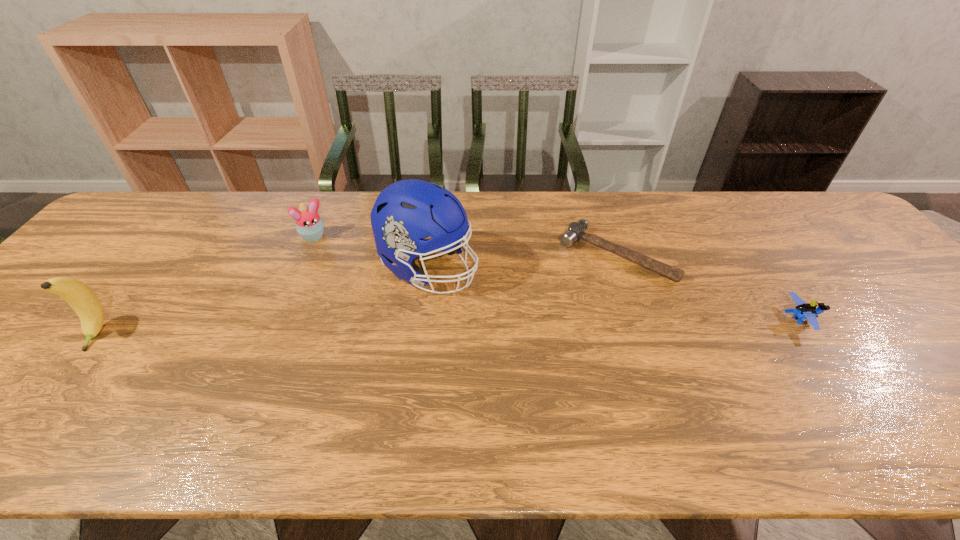
I want to click on vacant region between the cupcake and the hammer, so click(466, 246).

The height and width of the screenshot is (540, 960). I want to click on vacant point located between the Lego and the football helmet, so click(x=613, y=293).

Where is `unoccupied area between the third shortest object and the rightmost object`? This screenshot has height=540, width=960. unoccupied area between the third shortest object and the rightmost object is located at coordinates (557, 278).

Locate an element on the screen. The width and height of the screenshot is (960, 540). unoccupied position between the leftmost object and the rightmost object is located at coordinates (447, 327).

Find the location of `free space that is in between the rightmost object and the leftmost object`. free space that is in between the rightmost object and the leftmost object is located at coordinates (447, 327).

You are a GUI agent. You are given a task and a screenshot of the screen. Output one action in this format:
    pyautogui.click(x=<x>, y=<y>)
    Task: Click on the vacant space in between the third object from right to left and the second tallest object
    This screenshot has height=540, width=960.
    Given the screenshot: What is the action you would take?
    pyautogui.click(x=263, y=301)

At what (x,y) coordinates should I click in order to perform the action: click on vacant space that is in between the third tallest object and the banana. Please return your answer as a coordinate pair (x, y). The image size is (960, 540). Looking at the image, I should click on (206, 286).

Identify the location of free spot between the second tallest object and the rightmost object. This screenshot has width=960, height=540. (447, 327).

You are a GUI agent. You are given a task and a screenshot of the screen. Output one action in this format:
    pyautogui.click(x=<x>, y=<y>)
    Task: Click on the free space between the cupcake and the second object from right to left
    
    Given the screenshot: What is the action you would take?
    pyautogui.click(x=466, y=246)

The image size is (960, 540). In order to click on object that stands as the second closest to the fourth object from left to right in this screenshot , I will do `click(406, 212)`.